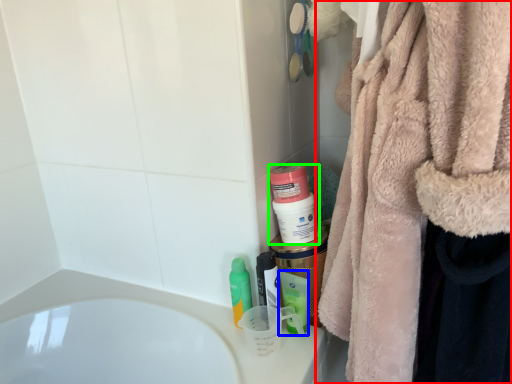
Question: Which object is the farthest from towel (highlighted by a red box)? Choose among these: mouthwash (highlighted by a blue box) or mouthwash (highlighted by a green box).

Choices:
 (A) mouthwash
 (B) mouthwash

Answer: (A)